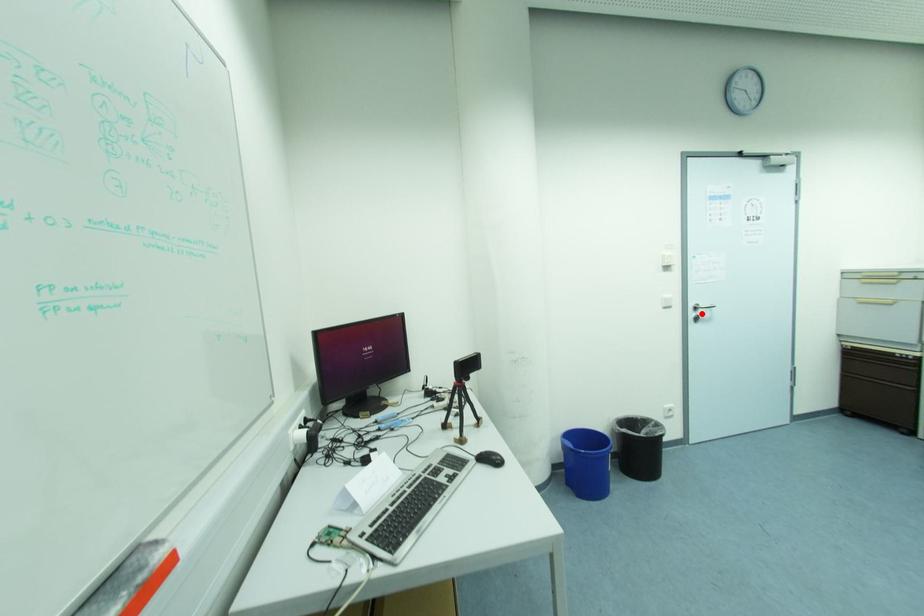
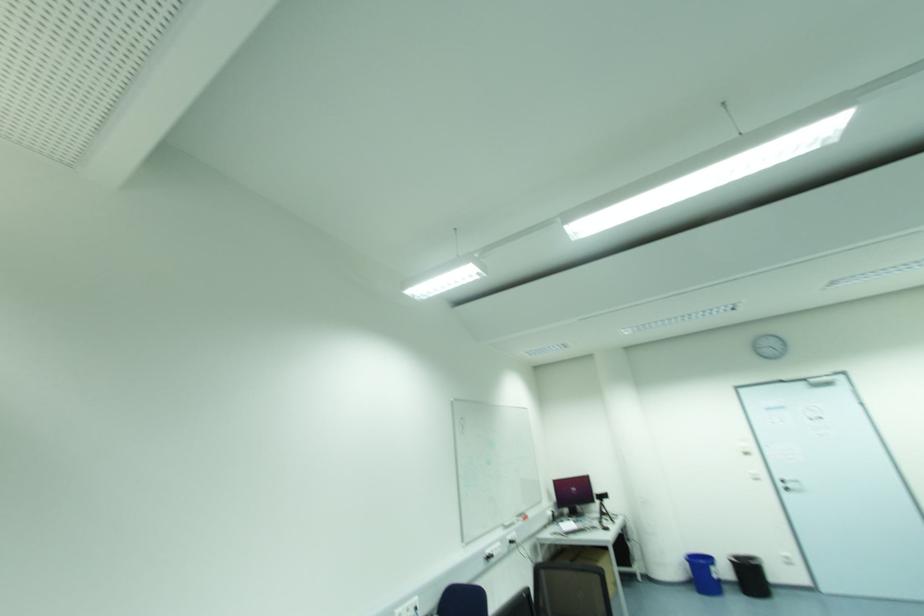
Question: I am providing you with two images of the same scene from different viewpoints. In image1, a red point is highlighted. Considering the same 3D point in image2, which of the following is correct?

Choices:
 (A) It is closer
 (B) It is farther

Answer: (A)